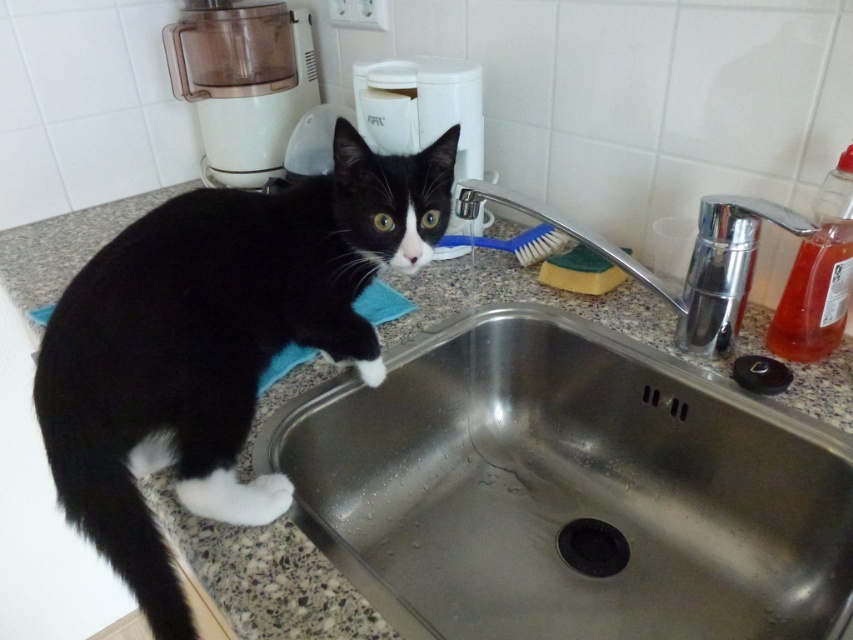
Question: Among these points, which one is farthest from the camera?

Choices:
 (A) (x=772, y=388)
 (B) (x=459, y=243)
 (C) (x=368, y=605)

Answer: (B)

Question: Is chrome metallic faucet at upper right smaller than black rubber drain at lower right?

Choices:
 (A) yes
 (B) no

Answer: (B)

Question: Can you confirm if black fur cat at upper left is wider than chrome metallic faucet at upper right?

Choices:
 (A) no
 (B) yes

Answer: (B)

Question: Which point is farther to the camera?

Choices:
 (A) black rubber drain at lower center
 (B) granite countertop at upper left

Answer: (A)

Question: Can you confirm if granite countertop at upper left is wider than black rubber drain at lower right?

Choices:
 (A) no
 (B) yes

Answer: (B)

Question: Which object appears closest to the camera in this image?

Choices:
 (A) white fluffy paw at lower left
 (B) chrome metallic faucet at upper right
 (C) granite countertop at upper left

Answer: (C)